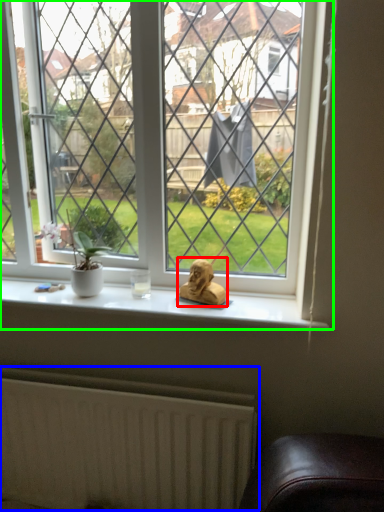
Question: Which object is the closest to the animal (highlighted by a red box)? Choose among these: radiator (highlighted by a blue box) or window (highlighted by a green box).

Choices:
 (A) radiator
 (B) window

Answer: (B)